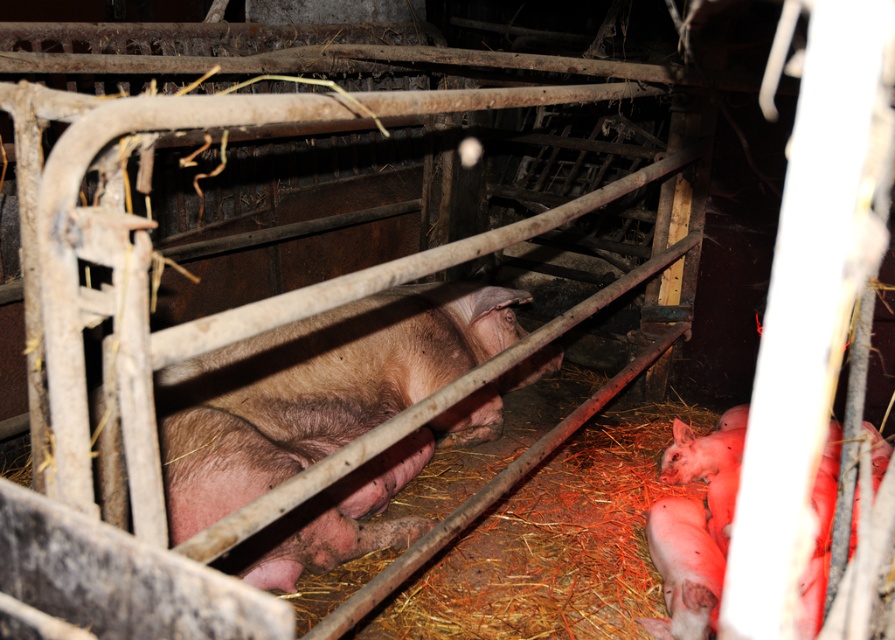
Question: Does pinkish-brown skin at center appear on the left side of pink soft piglet at lower right?

Choices:
 (A) no
 (B) yes

Answer: (B)

Question: Which of the following is the farthest from the observer?

Choices:
 (A) (339, 548)
 (B) (672, 596)

Answer: (A)

Question: Can you confirm if pink soft piglet at lower right is positioned above pink soft fur pig at lower right?

Choices:
 (A) yes
 (B) no

Answer: (A)

Question: From the image, what is the correct spatial relationship of pinkish-brown skin at center in relation to pink soft fur pig at lower right?

Choices:
 (A) left
 (B) right

Answer: (A)

Question: Which point is farther to the camera?

Choices:
 (A) (717, 445)
 (B) (687, 518)

Answer: (A)

Question: Estimate the real-world distances between objects in this image. Which object is closer to the pink soft piglet at lower right?

Choices:
 (A) pink soft fur pig at lower right
 (B) pinkish-brown skin at center

Answer: (A)